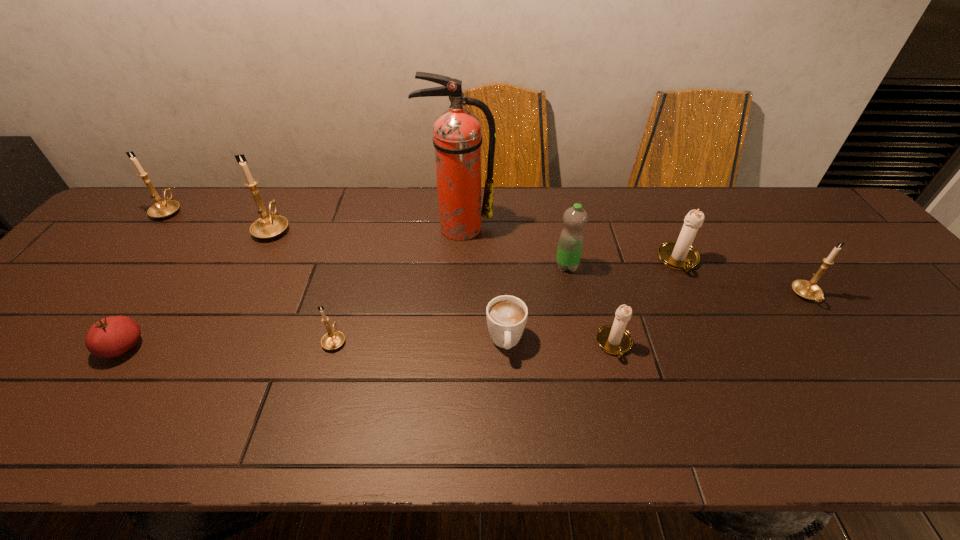
You are a GUI agent. You are given a task and a screenshot of the screen. Output one action in this format:
    pyautogui.click(x=<x>, y=<y>)
    Task: Click on the farther white candle holder
    The image size is (960, 540).
    Given the screenshot: What is the action you would take?
    pos(680,255)

In order to click on the second gold candle holder from right to left in this screenshot , I will do `click(333, 339)`.

What are the coordinates of `the fourth object from left to right` in the screenshot? It's located at (333, 339).

Locate an element on the screen. the eighth object from left to right is located at coordinates (614, 339).

Find the location of a particular element. The image size is (960, 540). the smaller white candle holder is located at coordinates 614,339.

At what (x,y) coordinates should I click in order to perform the action: click on the second object from left to right. Please return your answer as a coordinate pair (x, y). The image size is (960, 540). Looking at the image, I should click on (109, 337).

Where is `tomato`? This screenshot has height=540, width=960. tomato is located at coordinates tap(109, 337).

I want to click on white cappuccino, so pos(506,315).

Locate an element on the screen. Image resolution: width=960 pixels, height=540 pixels. free space located at the nozzle of the tallest object is located at coordinates (453, 323).

Identify the location of vacant space located 0.060m on the handle side of the second gold candle holder from left to right. This screenshot has width=960, height=540. (286, 203).